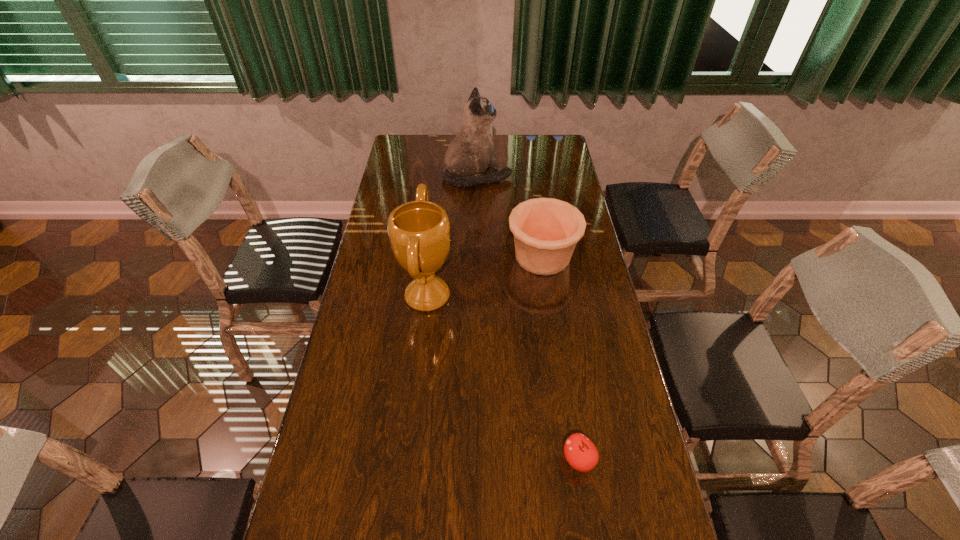
Identify the location of pottery that is at the right edge. (546, 230).

The image size is (960, 540). I want to click on apple positioned at the right edge, so click(580, 452).

You are a GUI agent. You are given a task and a screenshot of the screen. Output one action in this format:
    pyautogui.click(x=<x>, y=<y>)
    Task: Click on the vacant region at the left edge of the desktop
    Image resolution: width=960 pixels, height=540 pixels.
    Given the screenshot: What is the action you would take?
    coord(372,296)

Where is `vacant space at the right edge of the desktop`? This screenshot has height=540, width=960. vacant space at the right edge of the desktop is located at coordinates [574, 408].

Identify the location of vacant space at the far left corner. The width and height of the screenshot is (960, 540). (417, 159).

Identify the location of vacant area that lies between the farthest object and the nearest object. The height and width of the screenshot is (540, 960). click(x=528, y=318).

Identify the location of free spot between the nearest object and the award. This screenshot has width=960, height=540. (503, 377).

Locate an element on the screen. vacant area that lies between the farthest object and the award is located at coordinates (452, 237).

You are a GUI agent. You are given a task and a screenshot of the screen. Output one action in this format:
    pyautogui.click(x=<x>, y=<y>)
    Task: Click on the vacant region between the nearest object and the third tallest object
    
    Given the screenshot: What is the action you would take?
    pyautogui.click(x=561, y=358)

Identify the location of free space between the apple and the pottery. coord(561,358).